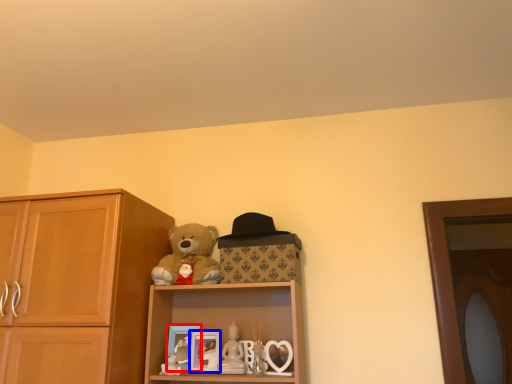
Question: Which object is closer to the camera taking this photo, picture frame (highlighted by a red box) or picture frame (highlighted by a blue box)?

Choices:
 (A) picture frame
 (B) picture frame

Answer: (B)